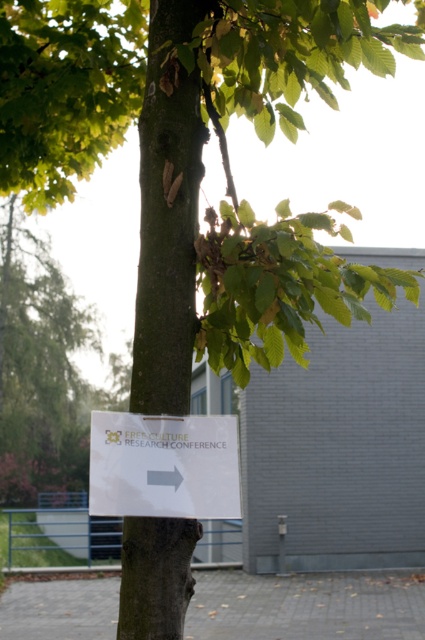
Does point (74, 628) lie behind point (226, 490)?

Yes, point (74, 628) is farther from viewer.

Is gray concrete pavement at lower center to the right of white paper sign at center from the viewer's perspective?

Indeed, gray concrete pavement at lower center is positioned on the right side of white paper sign at center.

Between point (391, 595) and point (229, 493), which one is positioned in front?

Point (229, 493) is more forward.

What are the coordinates of `gray concrete pavement at lower center` in the screenshot? It's located at (306, 605).

Can you confirm if smooth brown bark at center is positioned to the left of white paper sign at center?

No, smooth brown bark at center is not to the left of white paper sign at center.

Which is behind, point (178, 356) or point (214, 512)?

The point (178, 356) is behind.

The width and height of the screenshot is (425, 640). What do you see at coordinates (167, 211) in the screenshot?
I see `smooth brown bark at center` at bounding box center [167, 211].

Locate an element on the screen. smooth brown bark at center is located at coordinates (167, 211).

Is smooth brown bark at center shorter than gray concrete pavement at lower center?

In fact, smooth brown bark at center may be taller than gray concrete pavement at lower center.

Between smooth brown bark at center and gray concrete pavement at lower center, which one is positioned higher?

smooth brown bark at center

Locate an element on the screen. This screenshot has width=425, height=640. smooth brown bark at center is located at coordinates (167, 211).